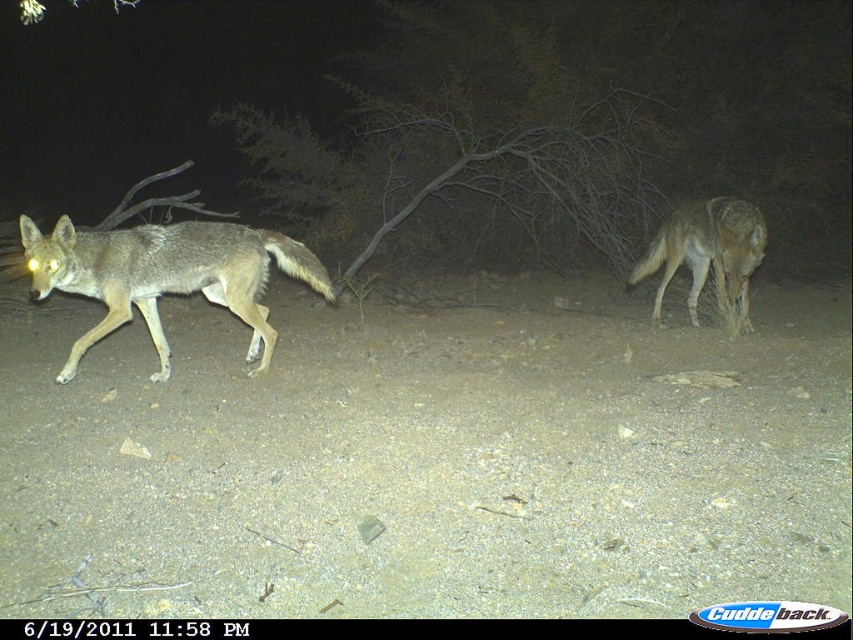
Does furry gray coyote at left have a smaller size compared to brown fur coyote at right?

Actually, furry gray coyote at left might be larger than brown fur coyote at right.

Which of these two, furry gray coyote at left or brown fur coyote at right, stands taller?

brown fur coyote at right

Is point (142, 243) positioned in front of point (740, 275)?

Yes, it is in front of point (740, 275).

I want to click on furry gray coyote at left, so click(165, 275).